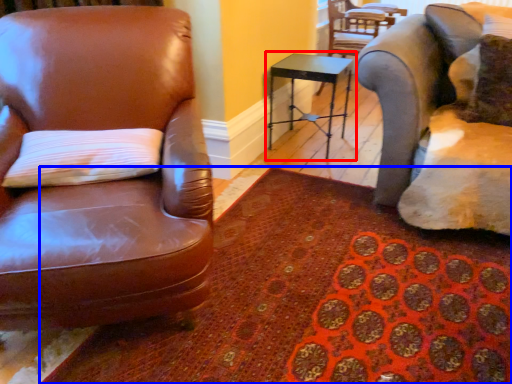
Question: Among these objects, which one is nearest to the camera, table (highlighted by a red box) or mat (highlighted by a blue box)?

Choices:
 (A) table
 (B) mat

Answer: (B)